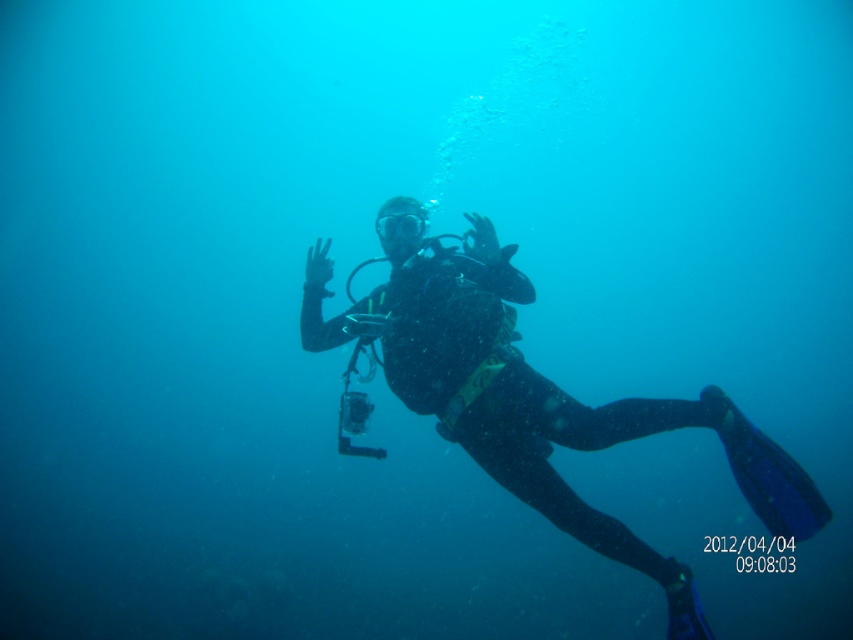
Question: Is black matte wetsuit at center below transparent rubber goggles at center?

Choices:
 (A) no
 (B) yes

Answer: (B)

Question: Which point appears closest to the camera in this image?

Choices:
 (A) (416, 225)
 (B) (550, 420)

Answer: (B)

Question: Can you confirm if black matte wetsuit at center is wider than transparent rubber goggles at center?

Choices:
 (A) yes
 (B) no

Answer: (A)

Question: Can you confirm if black matte wetsuit at center is bigger than transparent rubber goggles at center?

Choices:
 (A) yes
 (B) no

Answer: (A)